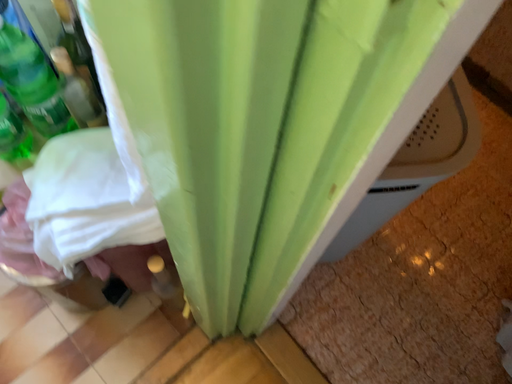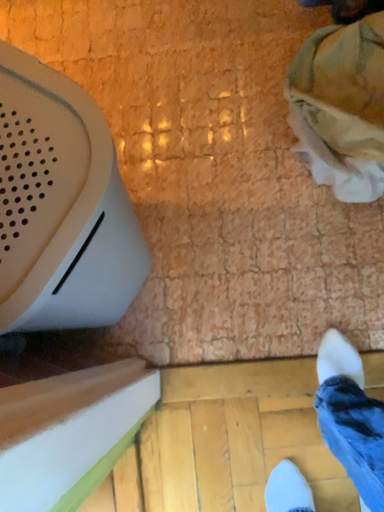
Question: Which way did the camera rotate in the video?

Choices:
 (A) rotated left
 (B) rotated right

Answer: (B)